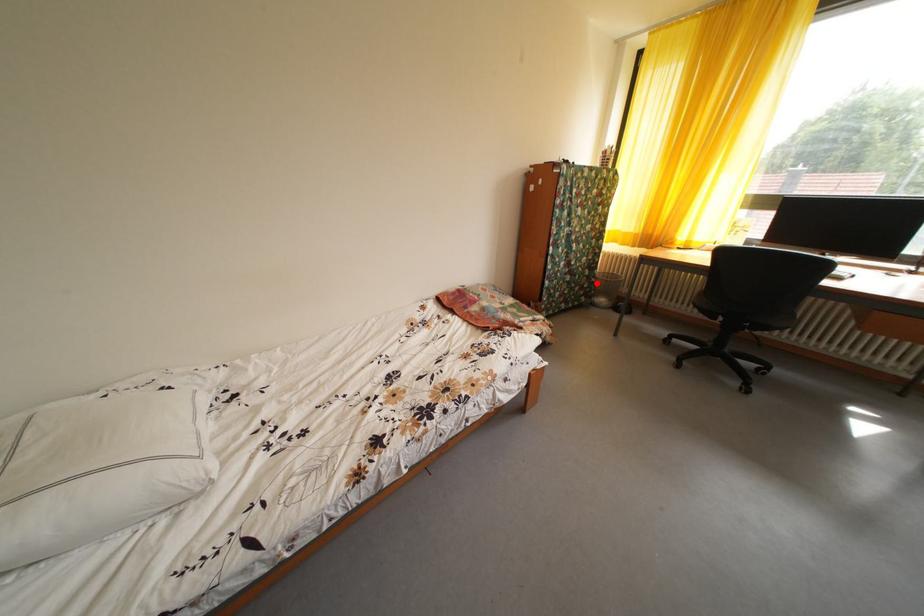
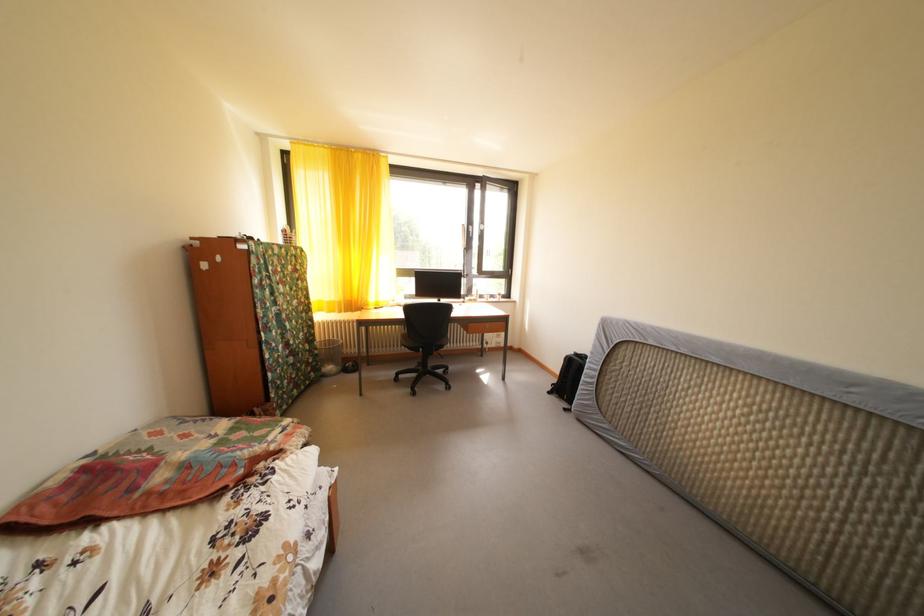
Where in the second image is the point corresponding to the highlighted location from the first image?

(320, 357)